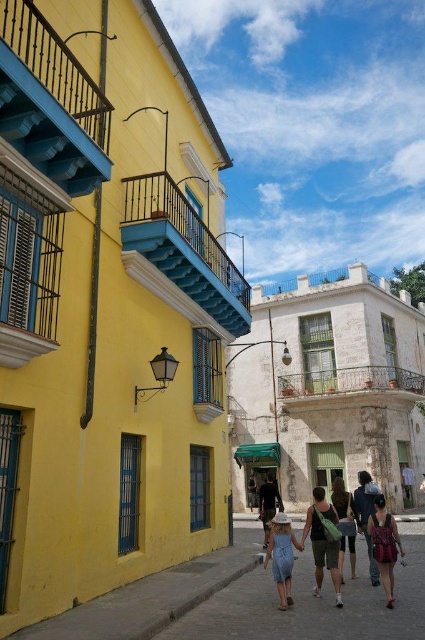
Question: Which object is closer to the camera taking this photo?

Choices:
 (A) matte green bag at center
 (B) dark gray fabric jacket at center
 (C) dark blue jeans at center
 (D) denim dress at center

Answer: (D)

Question: Which point is closer to the camera?

Choices:
 (A) denim dress at center
 (B) dark gray fabric jacket at center
 (C) matte black dress at center

Answer: (A)

Question: Is denim dress at center further to the viewer compared to dark blue jeans at center?

Choices:
 (A) yes
 (B) no

Answer: (B)

Question: Which object is the closest to the denim dress at center?

Choices:
 (A) dark blue jeans at center
 (B) matte green bag at center
 (C) matte black dress at center
 (D) dark gray fabric jacket at center

Answer: (B)

Question: Is matte black dress at center below dark blue jeans at center?

Choices:
 (A) yes
 (B) no

Answer: (A)

Question: Does matte black dress at center appear under dark gray fabric jacket at center?

Choices:
 (A) yes
 (B) no

Answer: (B)